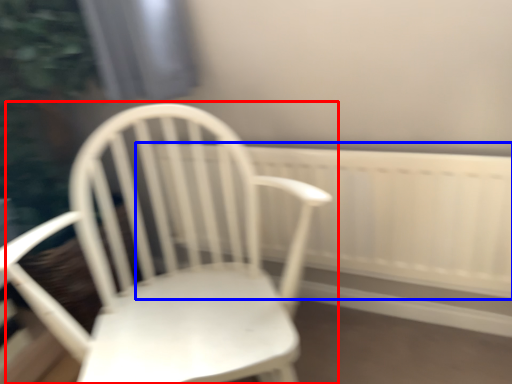
Question: Which object is further to the camera taking this photo, chair (highlighted by a red box) or radiator (highlighted by a blue box)?

Choices:
 (A) chair
 (B) radiator

Answer: (B)